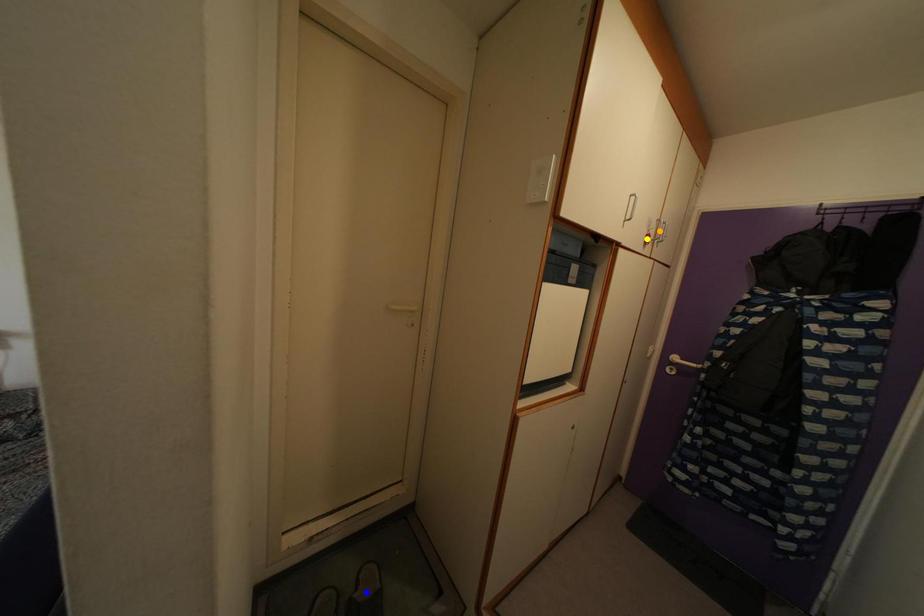
Order these from nearest to farthest:
A) yellow point
B) blue point
C) orange point

orange point
yellow point
blue point